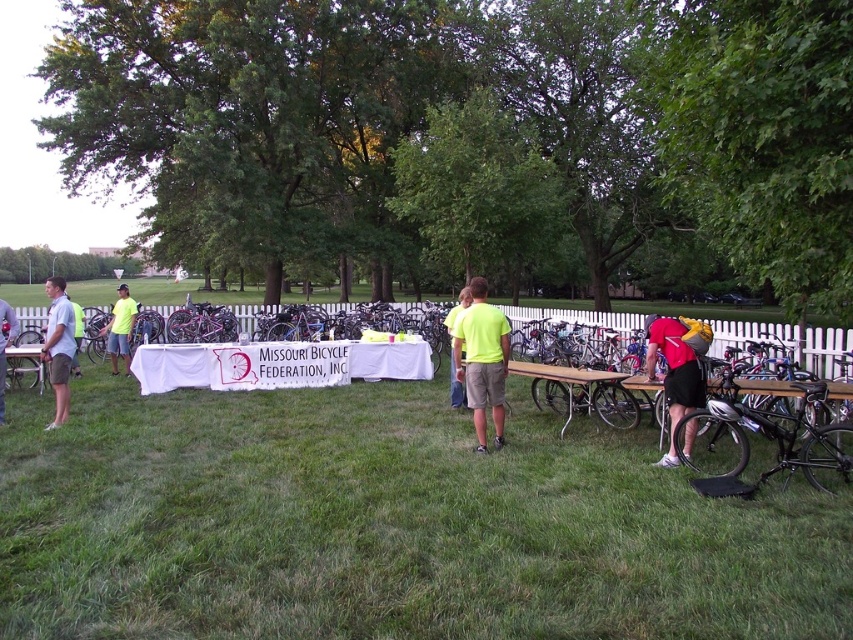
Is neon yellow shirt at center thinner than neon yellow t-shirt at center?

No.

Locate an element on the screen. neon yellow shirt at center is located at coordinates (482, 360).

Is light gray shirt at left thinner than neon yellow t-shirt at left?

In fact, light gray shirt at left might be wider than neon yellow t-shirt at left.

Can you confirm if light gray shirt at left is positioned below neon yellow t-shirt at left?

Incorrect, light gray shirt at left is not positioned below neon yellow t-shirt at left.

Locate an element on the screen. The width and height of the screenshot is (853, 640). light gray shirt at left is located at coordinates (57, 348).

You are a GUI agent. You are given a task and a screenshot of the screen. Output one action in this format:
    pyautogui.click(x=<x>, y=<y>)
    Task: Click on the light gray shirt at left
    This screenshot has width=853, height=640.
    Given the screenshot: What is the action you would take?
    pyautogui.click(x=57, y=348)

Can you confirm if neon yellow t-shirt at left is positioned above light green t-shirt at left?

Yes, neon yellow t-shirt at left is above light green t-shirt at left.

Which is more to the right, neon yellow t-shirt at left or light green t-shirt at left?

neon yellow t-shirt at left

Who is more distant from viewer, (111, 324) or (77, 314)?

Point (111, 324)

Identify the location of neon yellow t-shirt at left. The height and width of the screenshot is (640, 853). (120, 328).